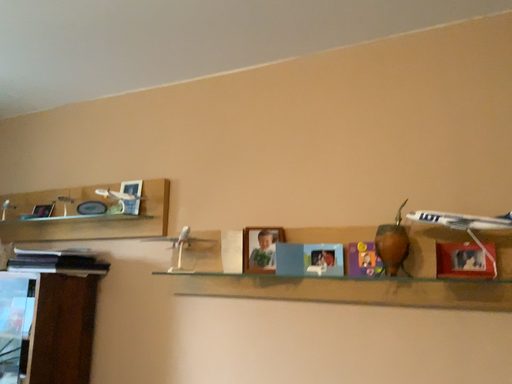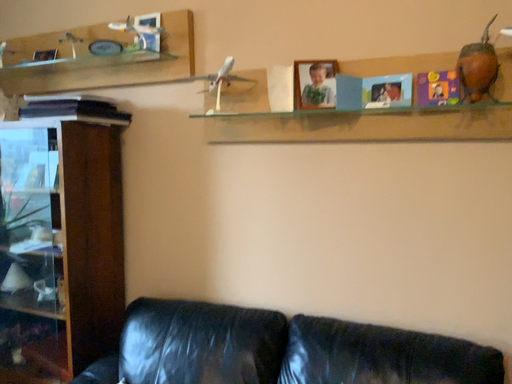
Question: Which way did the camera rotate in the video?

Choices:
 (A) rotated upward
 (B) rotated downward

Answer: (B)